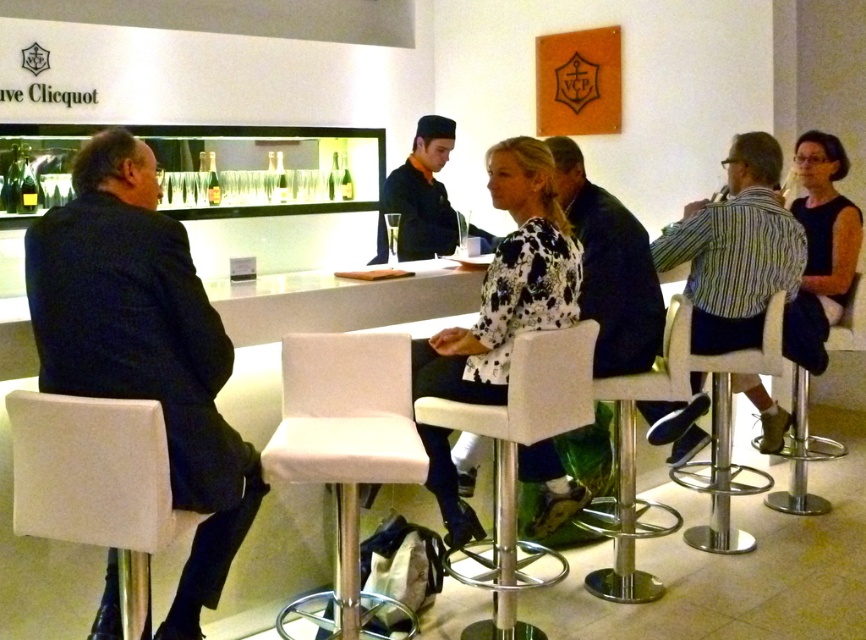
You are a bartender at the Veuve Clicquot bar. You need to place a new decorative item on the bar counter. The item requires a spot exactly at point (729, 440). Is there space available at that location?

The point (729, 440) is occupied by a metallic silver bar stool at center, so there is no space available at that location.

You are a bartender preparing to place a clear glass bottle at center on the counter. The metallic silver bar stool at center is in the way. Can you move the bottle to the counter without moving the stool?

The metallic silver bar stool at center is taller than the clear glass bottle at center, so you can place the bottle under the stool since it is shorter than the stool.